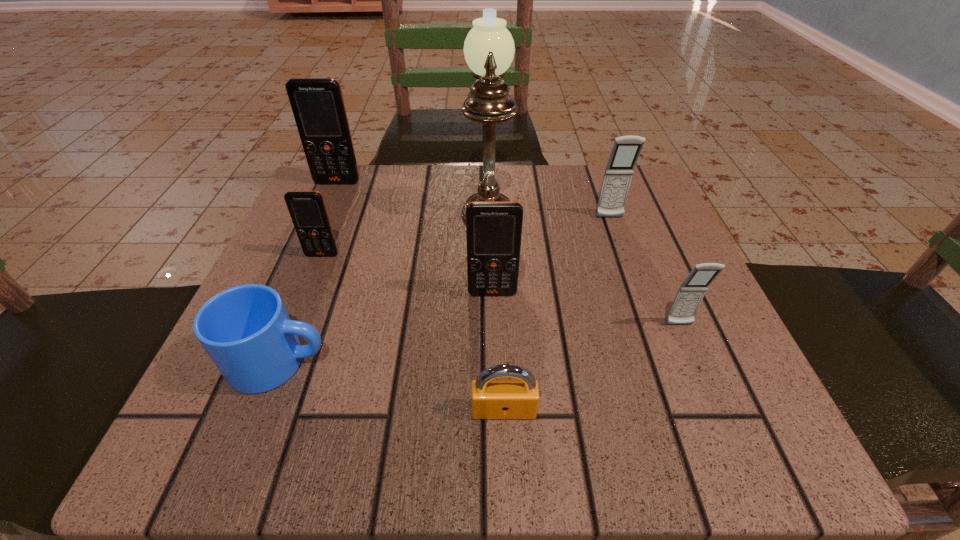
Image resolution: width=960 pixels, height=540 pixels. What are the coordinates of `vacant space at the near left corner of the desktop` in the screenshot? It's located at (189, 426).

In the image, there is a desktop. Where is `free space at the far right corner`? free space at the far right corner is located at coordinates (606, 221).

You are a GUI agent. You are given a task and a screenshot of the screen. Output one action in this format:
    pyautogui.click(x=<x>, y=<y>)
    Task: Click on the free space between the padlock and the seventh object from left to right
    This screenshot has width=960, height=540.
    Given the screenshot: What is the action you would take?
    pyautogui.click(x=557, y=314)

At what (x,y) coordinates should I click in order to perform the action: click on free space between the farthest cellular telephone and the smallest orange cellular telephone. Please return your answer as a coordinate pair (x, y). The image size is (960, 540). Looking at the image, I should click on (330, 219).

Locate an element on the screen. free point between the nearest object and the rightmost object is located at coordinates (591, 367).

This screenshot has width=960, height=540. In order to click on vacant point located between the tallest object and the nearest object in this screenshot , I will do `click(495, 304)`.

Locate an element on the screen. vacant space in between the nearest orange cellular telephone and the padlock is located at coordinates (498, 352).

I want to click on vacant space that is in between the farther gray cellular telephone and the third cellular telephone from left to right, so click(x=551, y=255).

Find the location of a particular element. Image resolution: width=960 pixels, height=540 pixels. vacant region between the nearer gray cellular telephone and the farther gray cellular telephone is located at coordinates (644, 272).

The image size is (960, 540). What are the coordinates of `free space that is in between the second tallest object and the nearest object` in the screenshot? It's located at (420, 296).